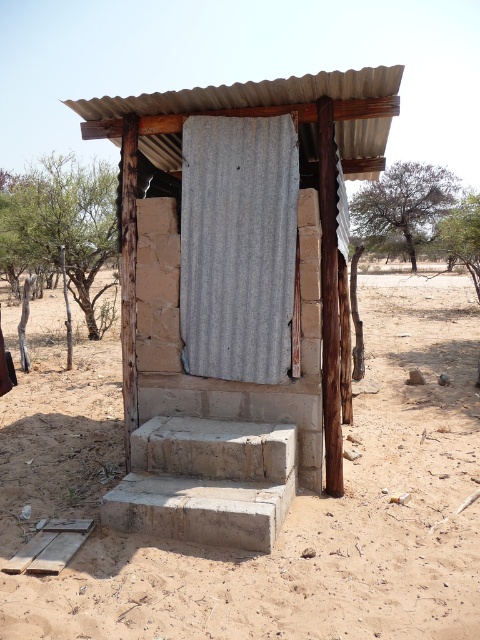
Question: Does dull brown dirt at center have a smaller size compared to gray corrugated metal door at center?

Choices:
 (A) no
 (B) yes

Answer: (A)

Question: Considering the real-world distances, which object is farthest from the gray corrugated metal door at center?

Choices:
 (A) dull brown dirt at center
 (B) corrugated metal hut at center

Answer: (A)

Question: Is corrugated metal hut at center bigger than dull brown dirt at center?

Choices:
 (A) no
 (B) yes

Answer: (A)

Question: Which of the following is the closest to the observer?

Choices:
 (A) (200, 353)
 (B) (57, 506)

Answer: (B)

Question: Which object is positioned farthest from the gray corrugated metal door at center?

Choices:
 (A) dull brown dirt at center
 (B) corrugated metal hut at center

Answer: (A)

Question: Does corrugated metal hut at center lie in front of gray corrugated metal door at center?

Choices:
 (A) no
 (B) yes

Answer: (B)